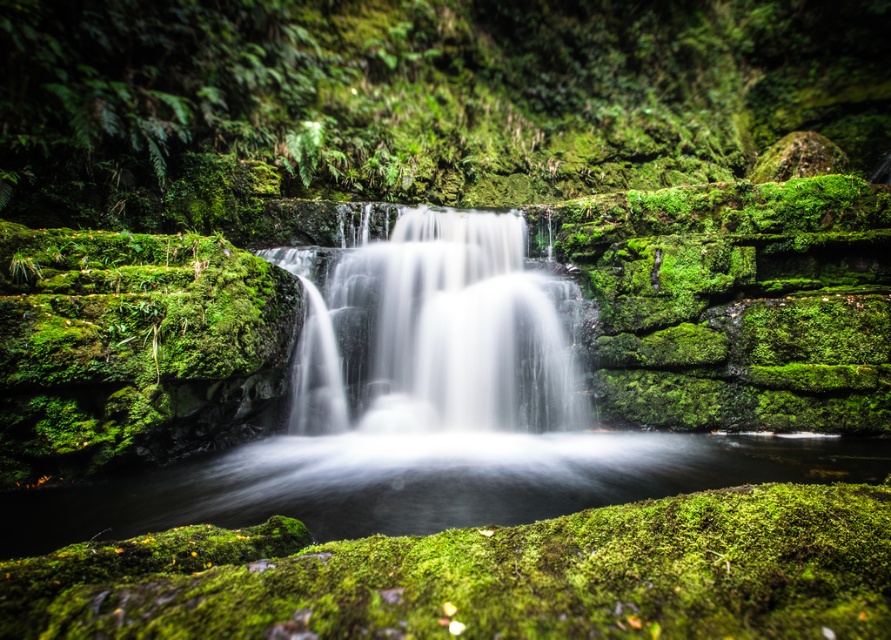
Question: Can you confirm if green mossy rock at center is wider than white silky water at center?

Choices:
 (A) no
 (B) yes

Answer: (B)

Question: Which of the following is the farthest from the observer?

Choices:
 (A) green mossy rock at center
 (B) white silky water at center

Answer: (A)

Question: Considering the relative positions of green mossy rock at center and white silky water at center in the image provided, where is green mossy rock at center located with respect to white silky water at center?

Choices:
 (A) below
 (B) above

Answer: (B)

Question: Is green mossy rock at center thinner than white silky water at center?

Choices:
 (A) no
 (B) yes

Answer: (A)

Question: Which of the following is the farthest from the observer?

Choices:
 (A) (275, 260)
 (B) (616, 67)

Answer: (B)

Question: Which of the following is the farthest from the observer?

Choices:
 (A) green mossy rock at center
 (B) white silky water at center

Answer: (A)